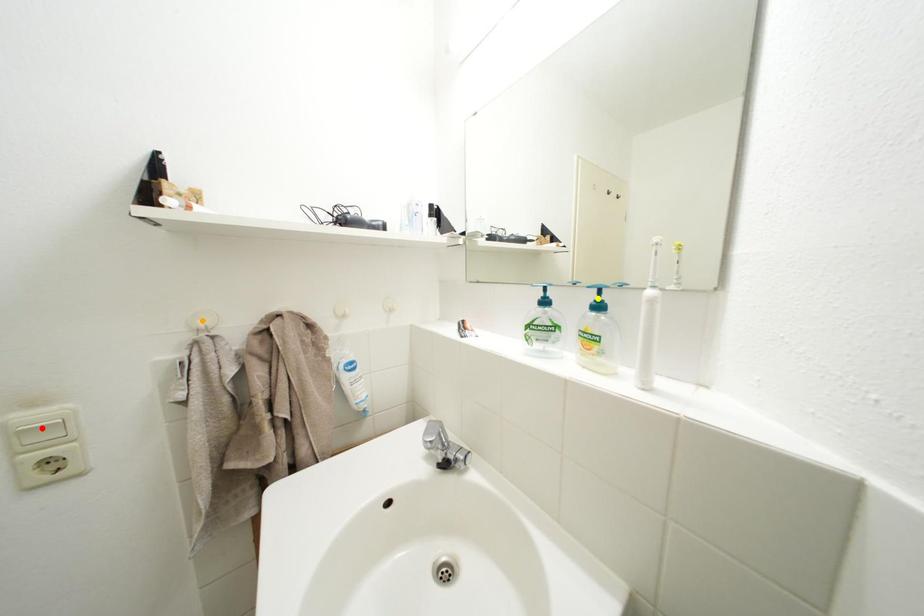
Order these from farthest to nearest:
1. yellow point
2. orange point
3. red point

yellow point
orange point
red point